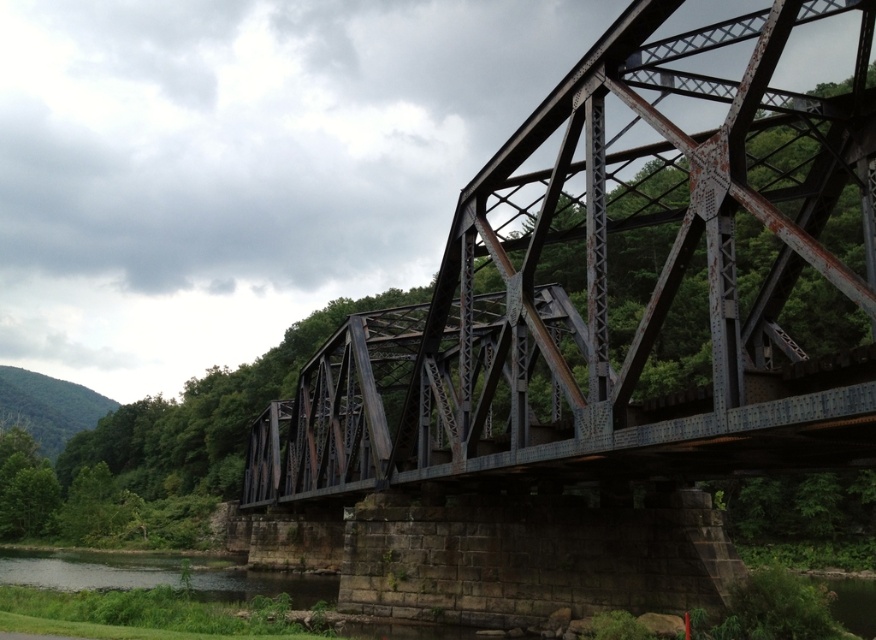
Question: Observing the image, what is the correct spatial positioning of rusty metal bridge at center in reference to dark gray water at lower left?

Choices:
 (A) above
 (B) below

Answer: (A)

Question: Among these points, which one is nearest to the camera?

Choices:
 (A) (258, 572)
 (B) (341, 445)

Answer: (B)

Question: Does rusty metal bridge at center appear under dark gray water at lower left?

Choices:
 (A) no
 (B) yes

Answer: (A)

Question: Is rusty metal bridge at center to the left of dark gray water at lower left from the viewer's perspective?

Choices:
 (A) yes
 (B) no

Answer: (B)

Question: Which object is closer to the camera taking this photo?

Choices:
 (A) rusty metal bridge at center
 (B) dark gray water at lower left

Answer: (A)